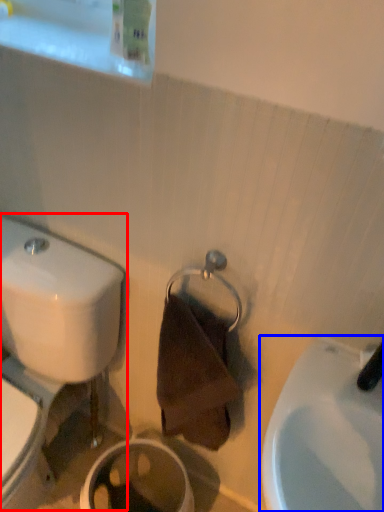
Question: Which of the following is the farthest to the observer, toilet (highlighted by a red box) or sink (highlighted by a blue box)?

Choices:
 (A) toilet
 (B) sink

Answer: (A)